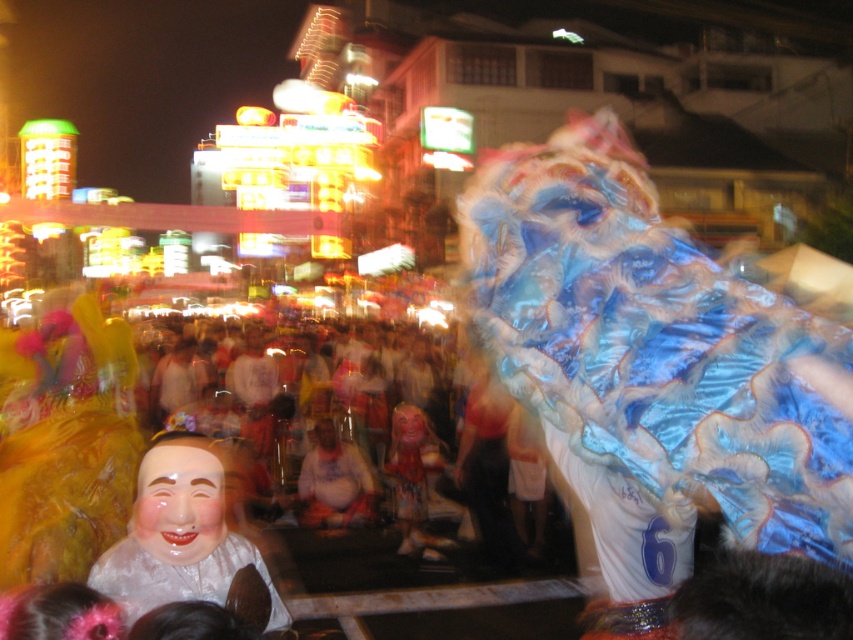
Does point (357, 456) come farther from viewer compared to point (419, 516)?

Yes, point (357, 456) is behind point (419, 516).

You are a GUI agent. You are given a task and a screenshot of the screen. Output one action in this format:
    pyautogui.click(x=<x>, y=<y>)
    Task: Click on the fat man in white shirt at center
    
    Given the screenshot: What is the action you would take?
    pyautogui.click(x=334, y=481)

Find the location of `fat man in white shirt at center`. fat man in white shirt at center is located at coordinates (334, 481).

Image resolution: width=853 pixels, height=640 pixels. What do you see at coordinates (186, 541) in the screenshot?
I see `smooth porcelain mask at center` at bounding box center [186, 541].

Does smooth porcelain mask at center appear on the right side of fat man in white shirt at center?

Yes, smooth porcelain mask at center is to the right of fat man in white shirt at center.

Which is in front, point (235, 545) or point (334, 483)?

Point (235, 545) is more forward.

Identify the location of smooth porcelain mask at center. (186, 541).

Consider the image. Which of these two, smooth porcelain mask at center or shiny blue fabric dragon at center, stands taller?

Standing taller between the two is shiny blue fabric dragon at center.

This screenshot has height=640, width=853. What do you see at coordinates (186, 541) in the screenshot? I see `smooth porcelain mask at center` at bounding box center [186, 541].

Where is `smooth porcelain mask at center`? The image size is (853, 640). smooth porcelain mask at center is located at coordinates (186, 541).